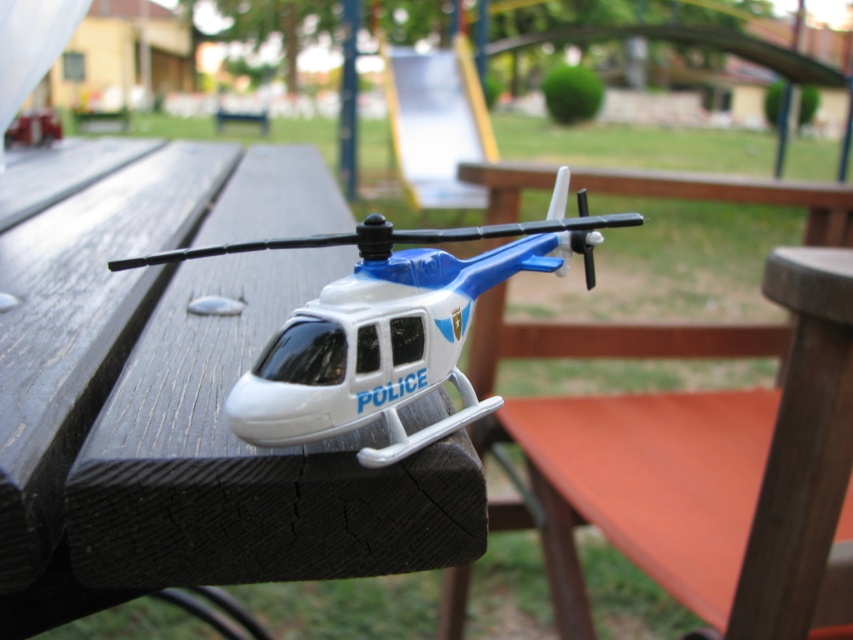
Does point (131, 412) come in front of point (437, 321)?

No, (131, 412) is further to viewer.

Is point (3, 573) behind point (318, 339)?

No, it is not.

Who is more forward, (x=339, y=225) or (x=335, y=356)?

Positioned in front is point (x=335, y=356).

The width and height of the screenshot is (853, 640). Find the location of `black wood table at center`. black wood table at center is located at coordinates point(196,448).